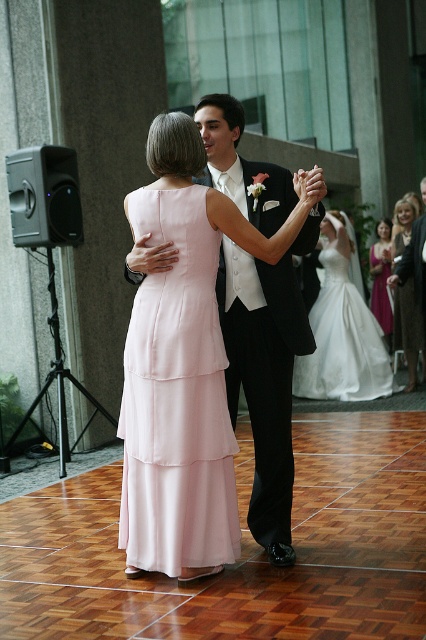
You are a photographer at a wedding reception. You want to capture a photo of the white satin tuxedo at center and the purple satin dress at right. Based on their positions, which one is closer to the camera?

The white satin tuxedo at center is positioned under the purple satin dress at right, meaning it is closer to the camera.

You are a photographer at a wedding reception and want to capture a photo of the white satin tuxedo at center and the purple satin dress at right. Based on their positions, which one will appear closer to the camera in the photo?

The white satin tuxedo at center will appear closer to the camera because it is positioned in front of the purple satin dress at right.